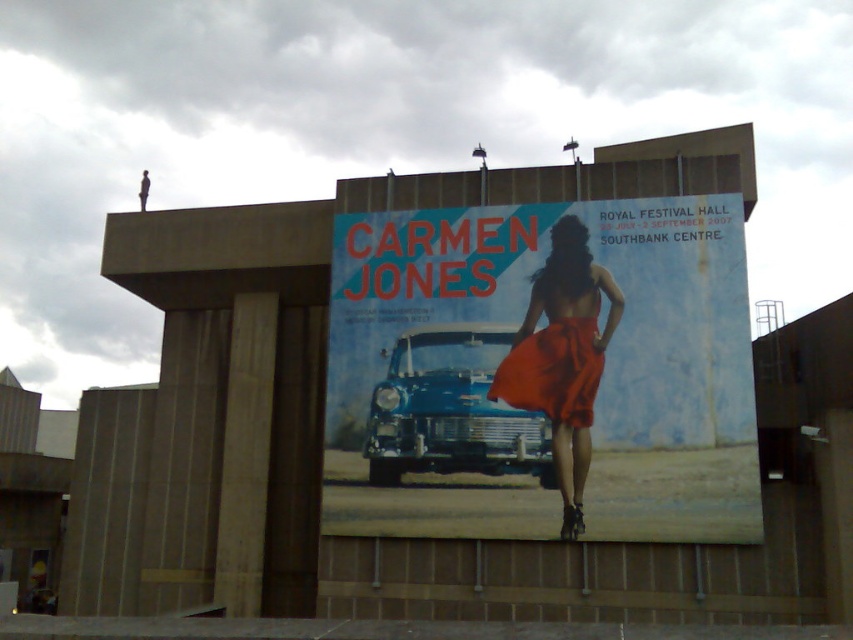
You are an event planner organizing a fashion show and need to decide which dress to feature first. Based on the image, which dress at the center of the billboard has a wider silhouette? Please choose between the satin red dress at center and the matte orange fabric dress at center.

The satin red dress at center has a larger width than the matte orange fabric dress at center, so it would be the wider option for the fashion show.

Looking at this image, you are standing in front of the billboard for Carmen Jones at the Royal Festival Hall. You notice two points on the billboard, one at coordinates point (x=538, y=362) and the other at point (x=553, y=330). Which point is nearer to you?

Point (x=538, y=362) is closer to the viewer than point (x=553, y=330).